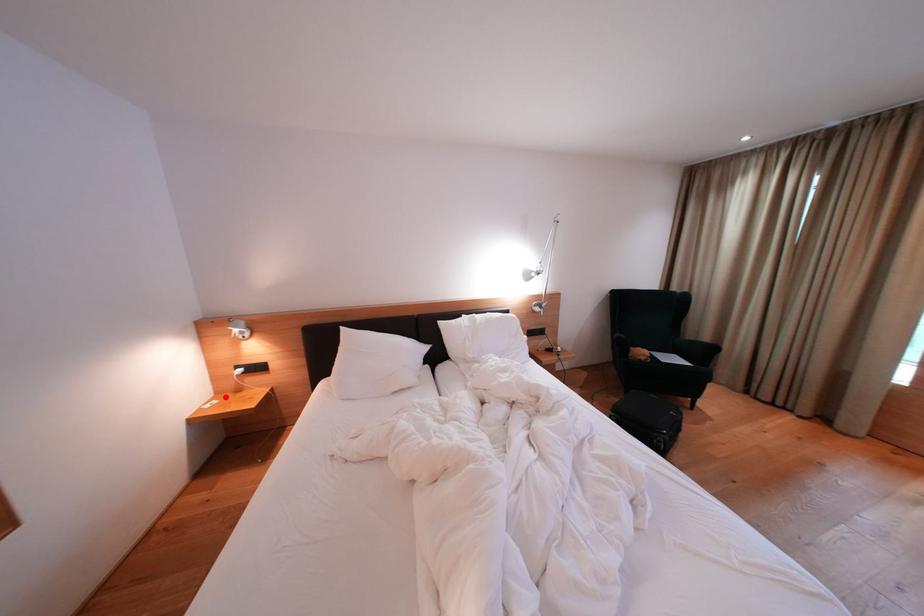
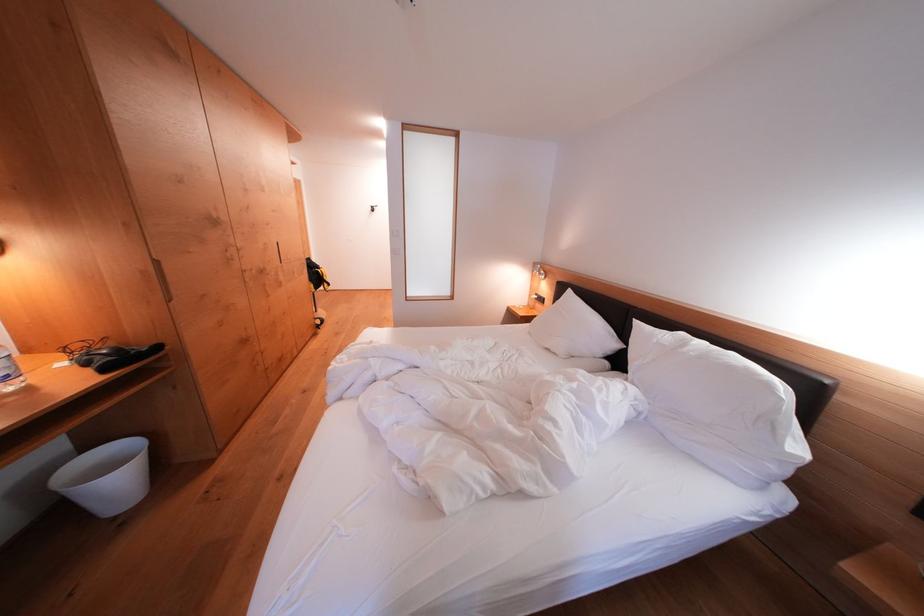
Question: I am providing you with two images of the same scene from different viewpoints. A red point is marked on the first image. At the location where the point appears in image 1, is it still visible in image 2?

Choices:
 (A) Yes
 (B) No

Answer: (A)